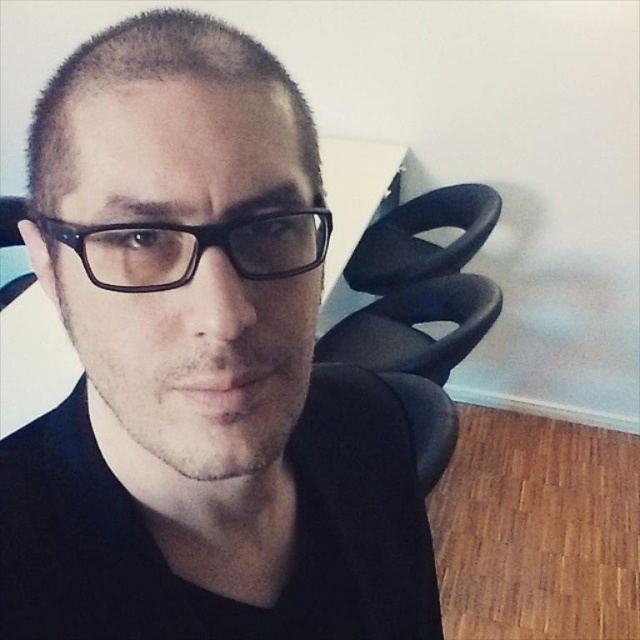
Question: Which of the following is the closest to the observer?

Choices:
 (A) (307, 259)
 (B) (4, 465)

Answer: (A)

Question: Where is matte black glasses at center located in relation to black plastic glasses at center in the image?

Choices:
 (A) right
 (B) left

Answer: (A)

Question: Among these objects, which one is nearest to the camera?

Choices:
 (A) black plastic glasses at center
 (B) matte black glasses at center

Answer: (B)

Question: Is matte black glasses at center further to camera compared to black plastic glasses at center?

Choices:
 (A) no
 (B) yes

Answer: (A)

Question: Can you confirm if matte black glasses at center is positioned above black plastic glasses at center?

Choices:
 (A) no
 (B) yes

Answer: (A)